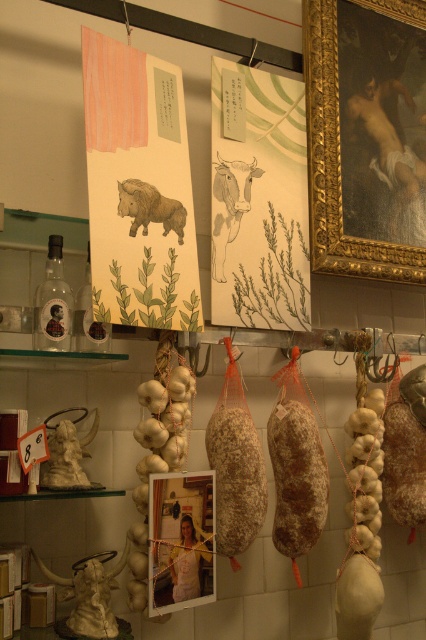
Question: Is brown textured paper at upper left closer to camera compared to white marble statue at left?

Choices:
 (A) yes
 (B) no

Answer: (B)

Question: Does white marble statue at left have a greater width compared to brown textured boar at center?

Choices:
 (A) yes
 (B) no

Answer: (B)

Question: Which point appears closest to the camera in this image?

Choices:
 (A) 81,326
 (B) 261,173
 (C) 187,477

Answer: (C)

Question: Which point is closer to the camera taking this photo?

Choices:
 (A) (138, 228)
 (B) (48, 292)
 (C) (215, 250)
 (D) (77, 476)

Answer: (D)

Question: Does brown textured salami at center appear on the right side of brown paper cow at center?

Choices:
 (A) no
 (B) yes

Answer: (B)

Question: Which object is closer to the camera taking this photo?

Choices:
 (A) brown textured salami at center
 (B) translucent glass bottle at left
 (C) white marble statue at left

Answer: (C)